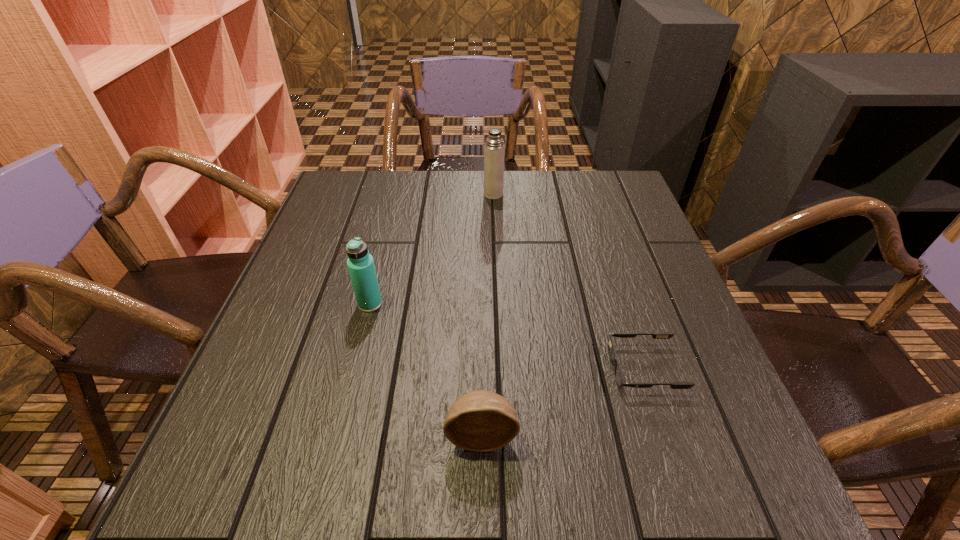
Image resolution: width=960 pixels, height=540 pixels. Identify the location of free space that is in between the second shortest object and the right thermos bottle. (488, 315).

In order to click on vacant area that lies between the nearest object and the farther thermos bottle in this screenshot , I will do `click(488, 315)`.

Locate an element on the screen. The image size is (960, 540). object that is the third closest one to the farther thermos bottle is located at coordinates (480, 420).

Select which object is the third closest to the second farthest object. Please provide its 2D coordinates. Your answer should be formatted as a tuple, i.e. [(x, y)], where the tuple contains the x and y coordinates of a point satisfying the conditions above.

[(619, 378)]

The image size is (960, 540). In order to click on blank area in the image that satisfies the following two spatial constraints: 1. on the temples of the rightmost object; 2. on the front side of the bowl in this screenshot , I will do `click(666, 435)`.

Identify the location of free location that satisfies the following two spatial constraints: 1. on the temples of the rightmost object; 2. on the front side of the third tallest object. This screenshot has width=960, height=540. (666, 435).